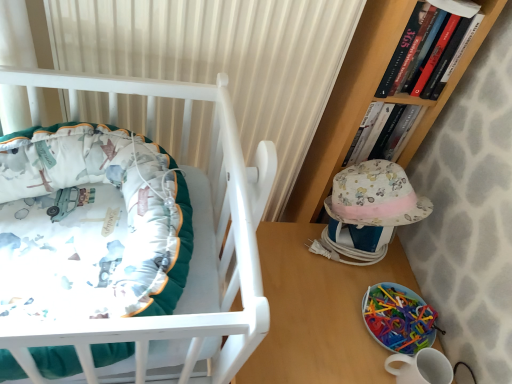
Identify the location of vacant space behind translucent plastic toy at lower right. This screenshot has width=512, height=384. (387, 263).